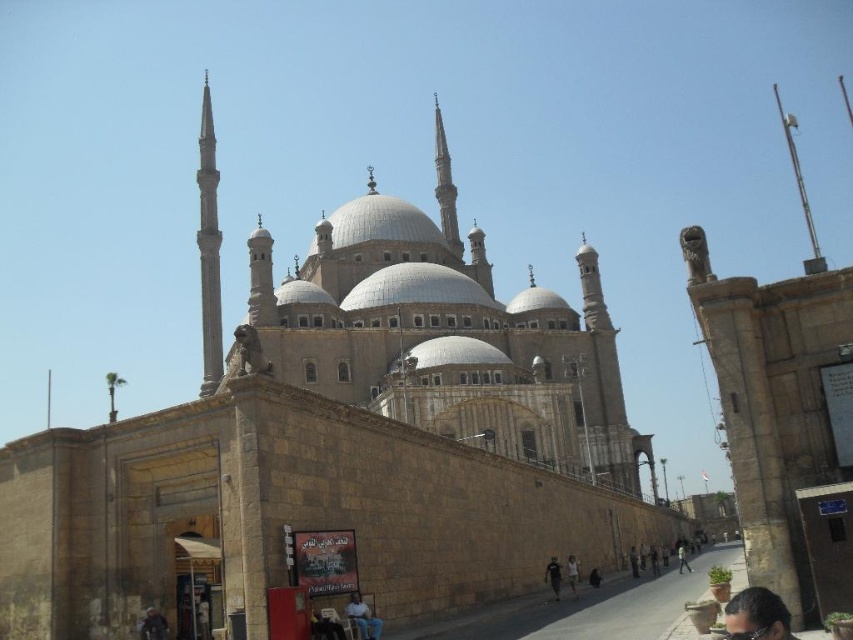
Question: Which point appears closest to the camera in this image?

Choices:
 (A) (548, 577)
 (B) (635, 552)
 (C) (376, 636)
 (D) (155, 628)

Answer: (C)

Question: Does dark gray fabric jacket at lower left appear over dark brown leather jacket at lower center?

Choices:
 (A) yes
 (B) no

Answer: (A)

Question: Does dark brown hair at lower right appear under dark brown leather jacket at lower center?

Choices:
 (A) no
 (B) yes

Answer: (A)

Question: Among these objects, which one is nearest to the camera?

Choices:
 (A) dark brown leather jacket at lower center
 (B) dark gray fabric jacket at lower left

Answer: (B)

Question: Which object is closer to the camera taking this photo?

Choices:
 (A) black fabric person at lower center
 (B) dark brown hair at lower right

Answer: (B)

Question: Is white cotton shirt at lower center in front of dark gray fabric jacket at lower center?

Choices:
 (A) no
 (B) yes

Answer: (B)